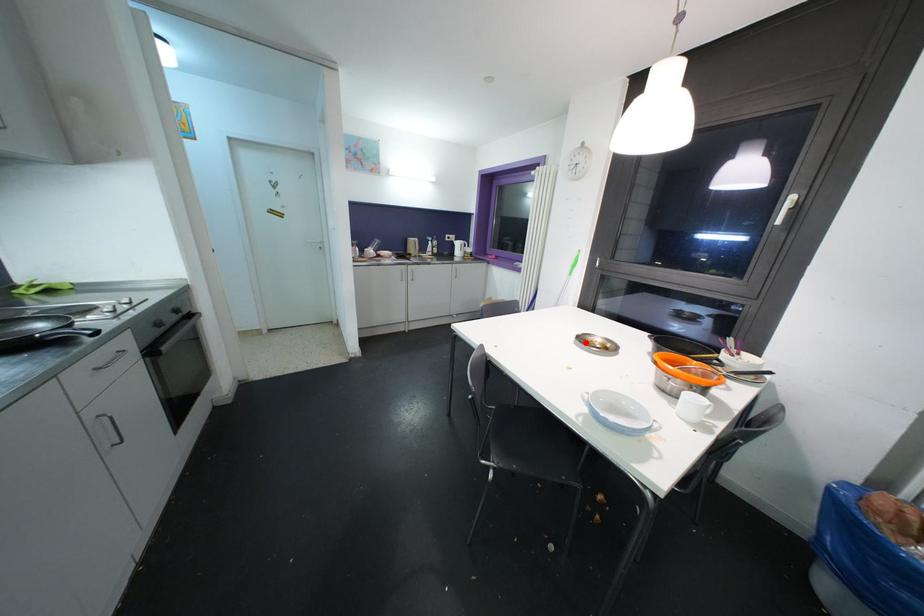
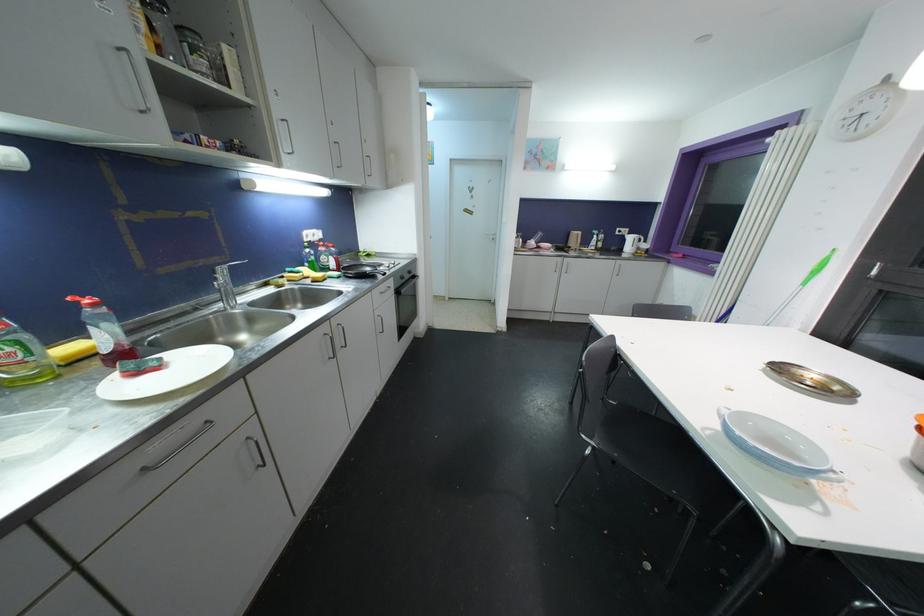
The point at the highlighted location is marked in the first image. Where is the corresponding point in the second image?

(784, 371)